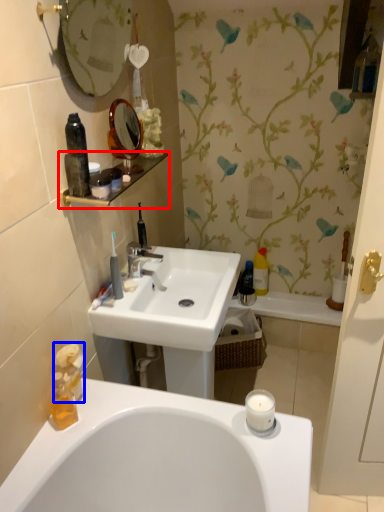
Question: Which object appears farthest to the camera in this image, balustrade (highlighted by a red box) or toiletry (highlighted by a blue box)?

Choices:
 (A) balustrade
 (B) toiletry

Answer: (B)